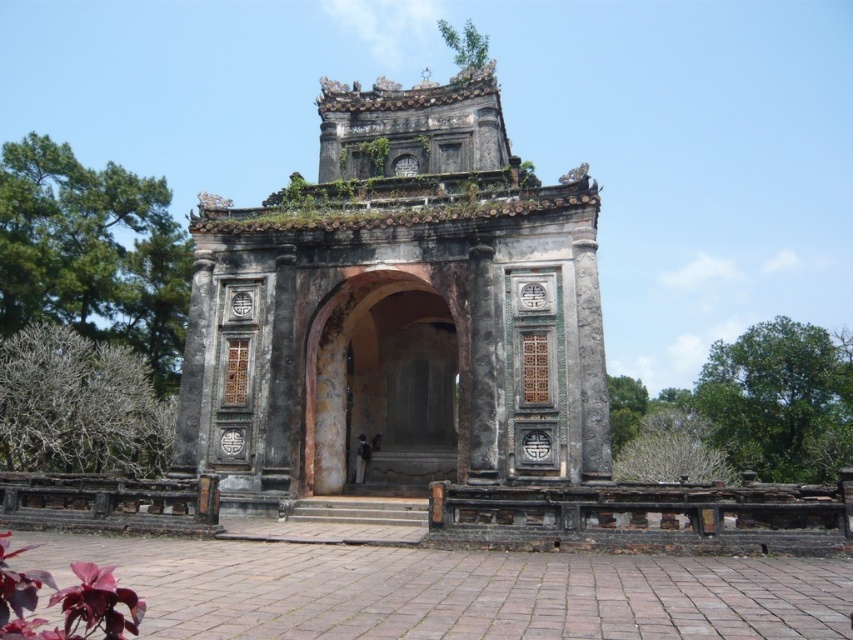
Question: Which point is farther to the camera?

Choices:
 (A) bare branches at left
 (B) green leafy tree at right

Answer: (B)

Question: Does green leafy tree at left have a smaller size compared to rusty stone archway at center?

Choices:
 (A) yes
 (B) no

Answer: (B)

Question: In this image, where is green leafy tree at left located relative to rusty stone archway at center?

Choices:
 (A) right
 (B) left

Answer: (B)

Question: Which point appears closest to the camera in this image?

Choices:
 (A) (106, 179)
 (B) (48, 401)
 (C) (814, 419)

Answer: (B)

Question: Is the position of green leafy tree at left more distant than that of green leafy tree at right?

Choices:
 (A) no
 (B) yes

Answer: (A)

Question: Which point is farther from the camera taking this photo?

Choices:
 (A) (149, 432)
 (B) (120, 170)
 (C) (814, 477)

Answer: (B)